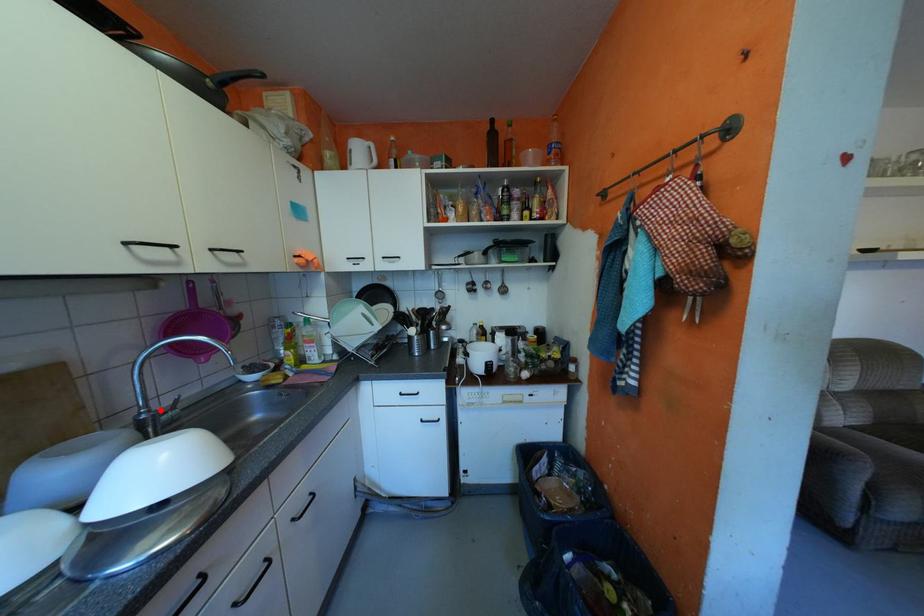
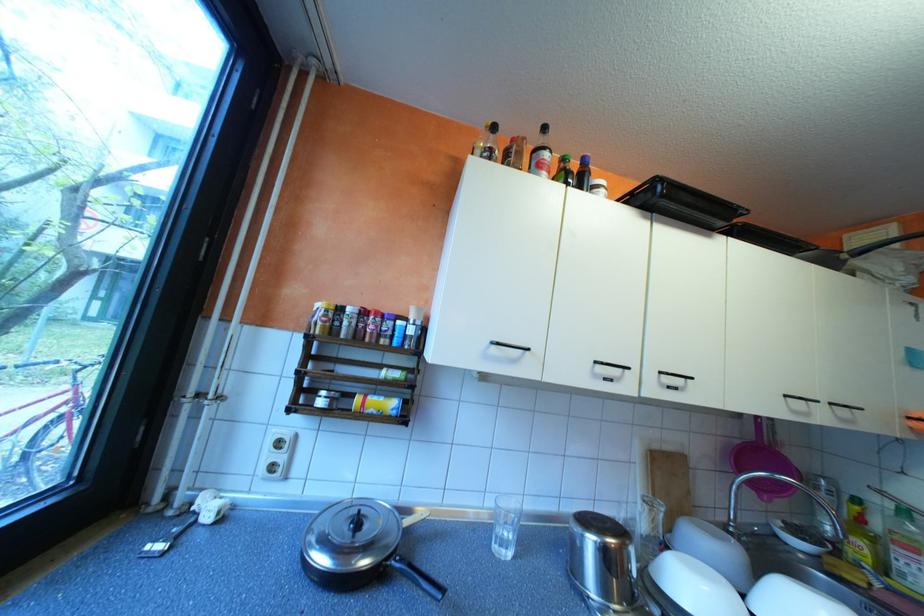
Locate, in the second image, the point that corresponds to the highlighted location in the first image.

(747, 525)